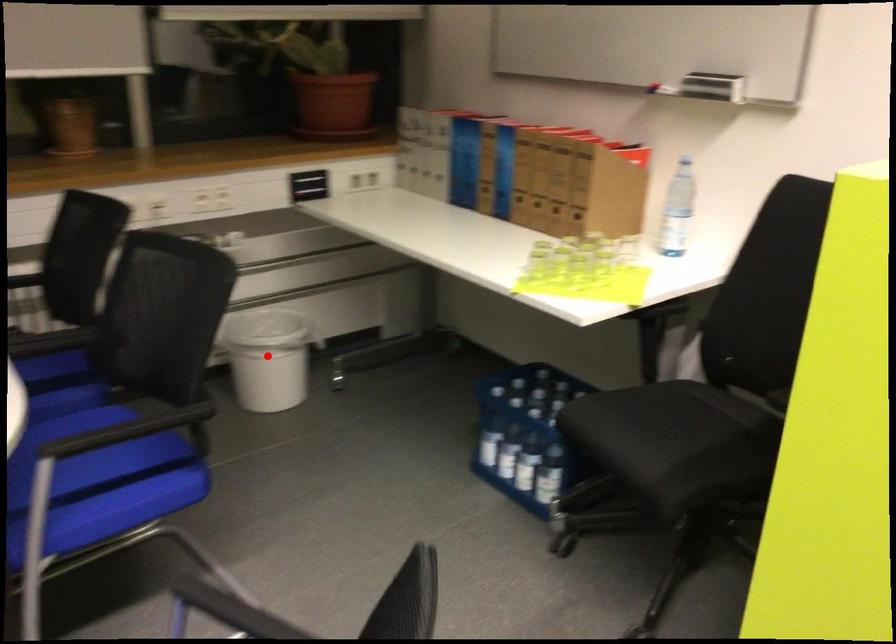
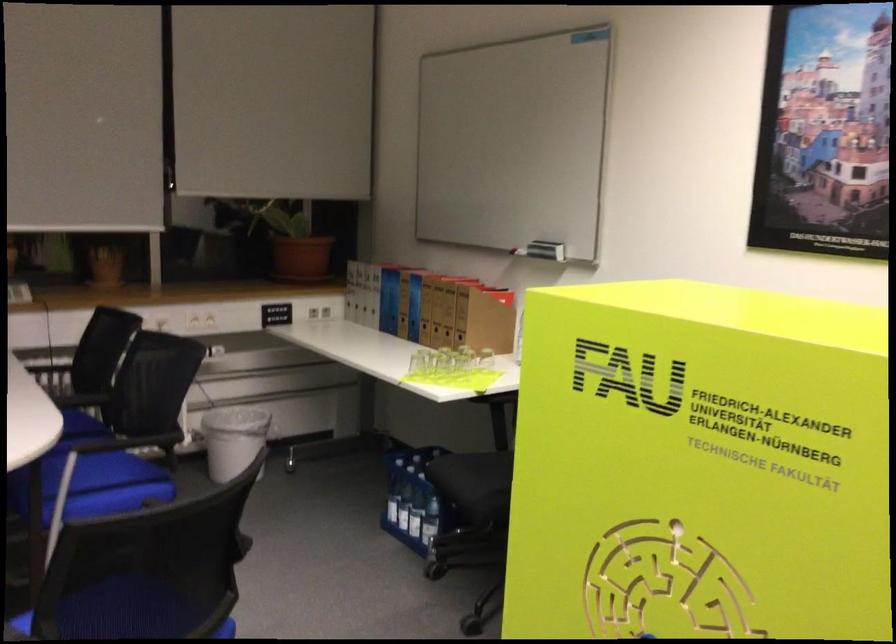
Question: I am providing you with two images of the same scene from different viewpoints. Image1 has a red point marked. In image2, the corresponding 3D location appears at what relative position? Reply with the corresponding letter.

Choices:
 (A) Closer
 (B) Farther

Answer: (B)